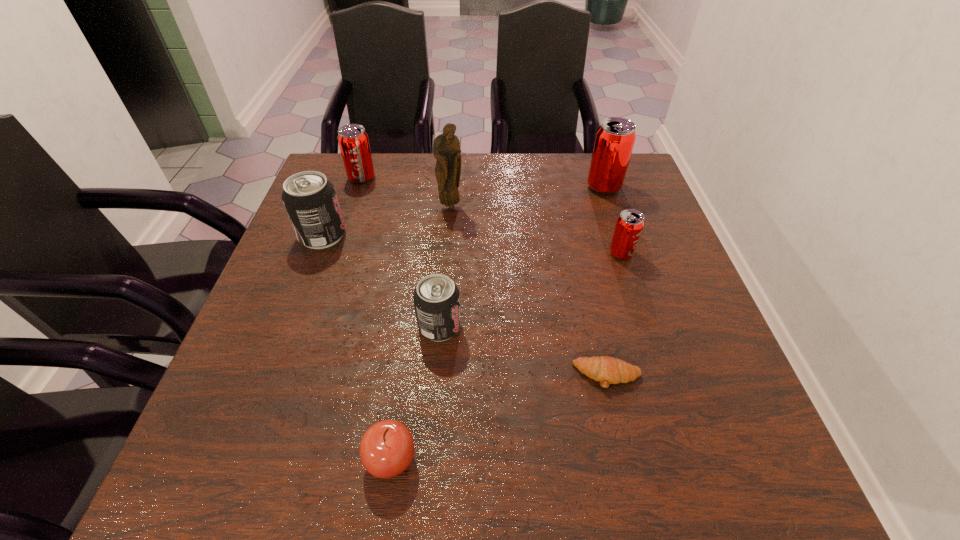
At what (x,y) coordinates should I click in order to perform the action: click on free space between the nearest red soda can and the left black soda can. Please return your answer as a coordinate pair (x, y). The image size is (960, 540). Looking at the image, I should click on (471, 245).

Identify the location of object that is the fourth closest to the third nearest object. (446, 147).

Where is `object that is the closest to the left black soda can`? object that is the closest to the left black soda can is located at coordinates (353, 140).

Identify the location of soda can that can be found as the second closest to the nearest object. This screenshot has height=540, width=960. (310, 200).

Identify the location of soda can identified as the fourth closest to the right black soda can. The width and height of the screenshot is (960, 540). (615, 138).

Where is `red soda can that is the second nearest to the nearest soda can`? red soda can that is the second nearest to the nearest soda can is located at coordinates (x=353, y=140).

Select which red soda can is the second closest to the smallest red soda can. Please provide its 2D coordinates. Your answer should be formatted as a tuple, i.e. [(x, y)], where the tuple contains the x and y coordinates of a point satisfying the conditions above.

[(353, 140)]

At what (x,y) coordinates should I click in order to perform the action: click on free space that satisfies the following two spatial constraints: 1. on the back side of the second shortest object; 2. on the left side of the tallest soda can. Please return your answer as a coordinate pair (x, y). The height and width of the screenshot is (540, 960). Looking at the image, I should click on (429, 187).

In order to click on free space in the image that satisfies the following two spatial constraints: 1. on the back side of the smaller black soda can; 2. on the left side of the apple in this screenshot , I will do `click(409, 326)`.